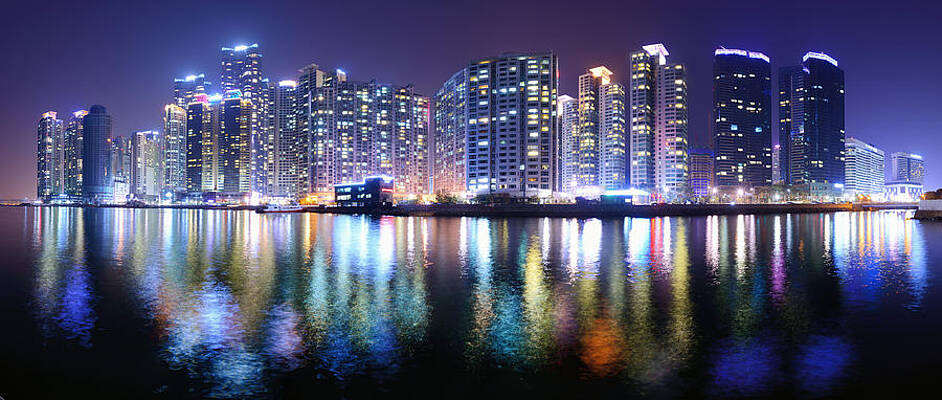
Find the location of a particular element. The height and width of the screenshot is (400, 942). blue lights is located at coordinates (821, 361), (748, 370), (339, 350), (369, 342), (79, 295), (861, 275), (918, 281), (229, 46), (186, 87).